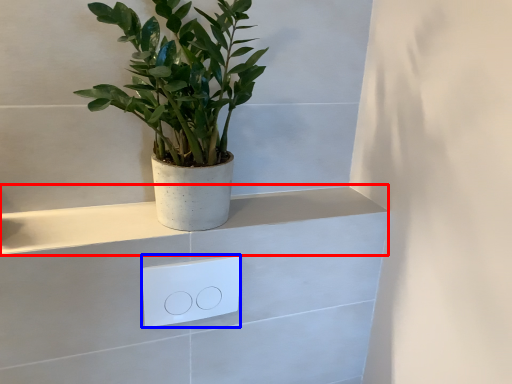
Question: Which point is closer to the camera, ledge (highlighted by a red box) or light switch (highlighted by a blue box)?

Choices:
 (A) ledge
 (B) light switch

Answer: (A)